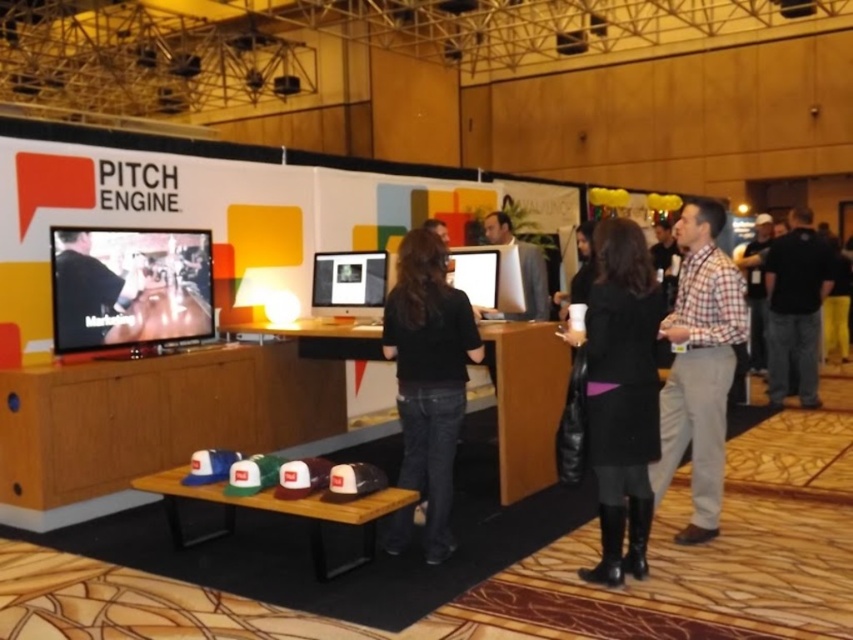
Question: Does plaid cotton shirt at right come in front of matte black monitor at center?

Choices:
 (A) yes
 (B) no

Answer: (A)

Question: Can you confirm if plaid shirt at center is thinner than matte black monitor at center?

Choices:
 (A) yes
 (B) no

Answer: (B)

Question: Where is plaid cotton shirt at right located in relation to matte black monitor at center in the image?

Choices:
 (A) left
 (B) right

Answer: (B)

Question: Which object is the closest to the black leather jacket at center?

Choices:
 (A) black wool coat at center
 (B) black cotton shirt at right

Answer: (A)

Question: Which of the following is the farthest from the observer?

Choices:
 (A) matte black shirt at center
 (B) matte black monitor at center
 (C) black matte shirt at center
 (D) black leather jacket at center

Answer: (D)

Question: Based on their relative distances, which object is nearer to the black matte shirt at center?

Choices:
 (A) black wool coat at center
 (B) matte black monitor at center
 (C) plaid shirt at center
 (D) black leather jacket at center

Answer: (A)